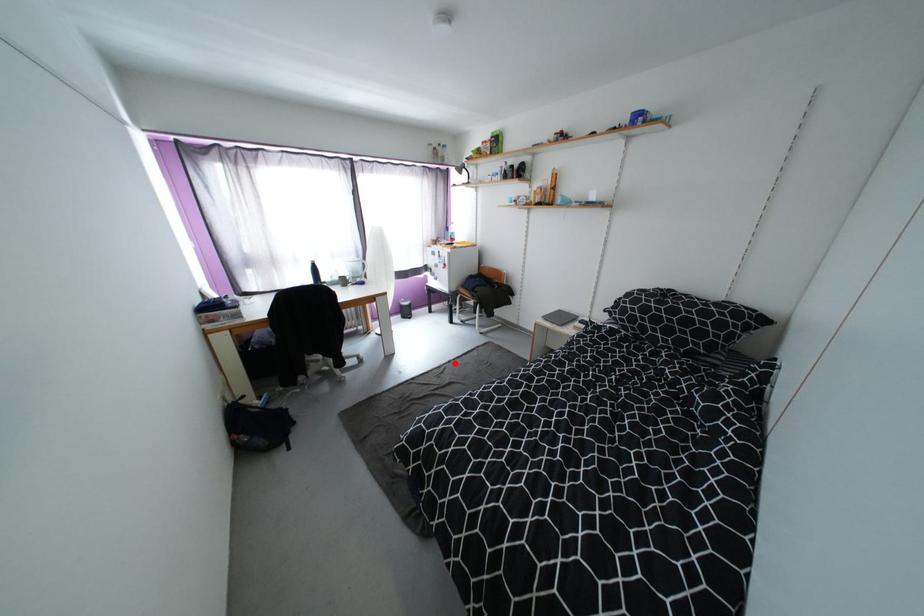
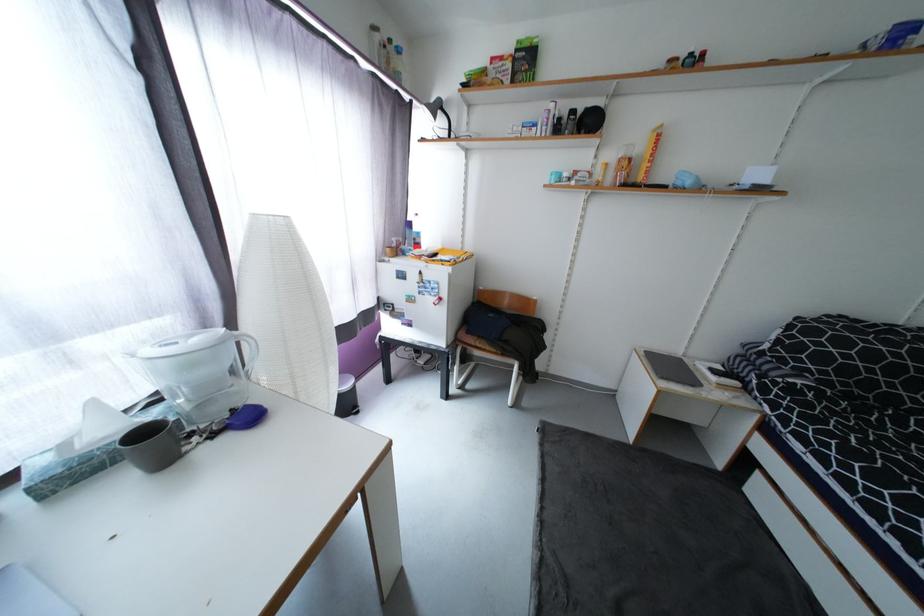
Question: I am providing you with two images of the same scene from different viewpoints. A red point is marked on the first image. Is the red point's position out of view in image 2?

Choices:
 (A) Yes
 (B) No

Answer: (B)